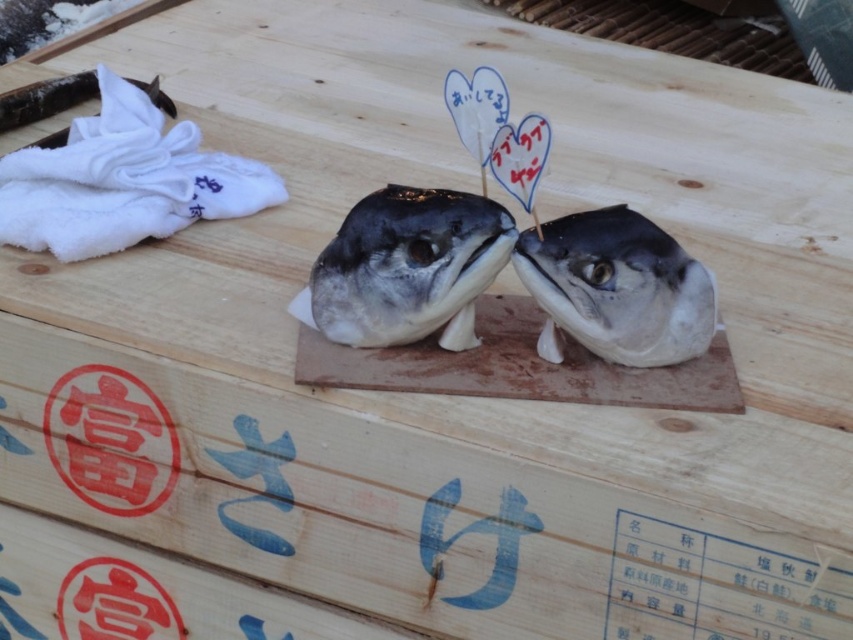
You are arranging items on a wooden surface and need to place a white towel at upper left and a shiny silver fish head at center. Based on the scene, which item is positioned to the right of the other?

The shiny silver fish head at center is to the right of the white towel at upper left.

You are a chef preparing to clean the shiny silver fish head at center. You need to move it to the sink, which is behind the white towel at upper left. Can you lift the fish head without moving the towel?

The white towel at upper left is above the shiny silver fish head at center, so you can lift the fish head without moving the towel since it is positioned below the towel.